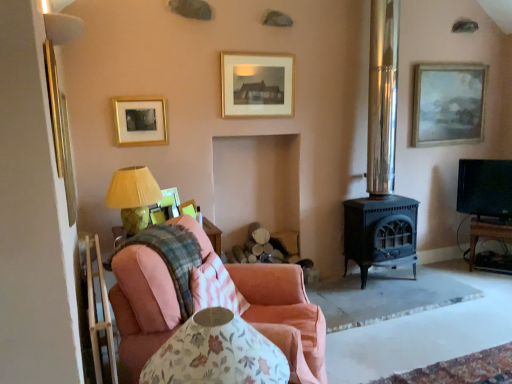
Question: Considering the relative sizes of pink fabric chair at lower left and white fabric lampshade at upper left in the image provided, is pink fabric chair at lower left thinner than white fabric lampshade at upper left?

Choices:
 (A) no
 (B) yes

Answer: (B)

Question: From the image's perspective, is pink fabric chair at lower left on top of white fabric lampshade at upper left?

Choices:
 (A) yes
 (B) no

Answer: (B)

Question: Can you confirm if pink fabric chair at lower left is positioned to the right of white fabric lampshade at upper left?

Choices:
 (A) yes
 (B) no

Answer: (A)

Question: Is pink fabric chair at lower left far away from white fabric lampshade at upper left?

Choices:
 (A) yes
 (B) no

Answer: (A)

Question: Is pink fabric chair at lower left wider than white fabric lampshade at upper left?

Choices:
 (A) yes
 (B) no

Answer: (B)

Question: Is pink fabric chair at lower left bigger than white fabric lampshade at upper left?

Choices:
 (A) yes
 (B) no

Answer: (A)

Question: Is wooden tv stand at right inside polished metal stove at center-right?

Choices:
 (A) yes
 (B) no

Answer: (B)

Question: From the image's perspective, is polished metal stove at center-right located above wooden tv stand at right?

Choices:
 (A) yes
 (B) no

Answer: (A)

Question: Is polished metal stove at center-right in front of wooden tv stand at right?

Choices:
 (A) yes
 (B) no

Answer: (A)

Question: From the image's perspective, is polished metal stove at center-right beneath wooden tv stand at right?

Choices:
 (A) yes
 (B) no

Answer: (B)

Question: Can you confirm if polished metal stove at center-right is positioned to the left of wooden tv stand at right?

Choices:
 (A) yes
 (B) no

Answer: (A)

Question: From a real-world perspective, is polished metal stove at center-right positioned under wooden tv stand at right based on gravity?

Choices:
 (A) no
 (B) yes

Answer: (A)

Question: Are pink fabric chair at lower left and black glossy tv at right located far from each other?

Choices:
 (A) yes
 (B) no

Answer: (A)